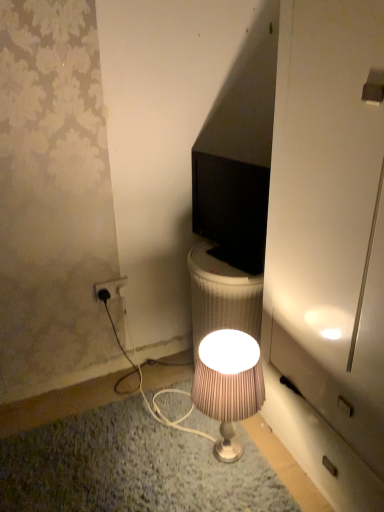
Where is `silky beige lampshade at center`? silky beige lampshade at center is located at coordinates (228, 384).

Find the location of a particular element. The image size is (384, 512). black glossy monitor at center is located at coordinates (231, 209).

Between point (230, 400) and point (119, 287), which one is positioned behind?

The point (119, 287) is farther from the camera.

Which is correct: silky beige lampshade at center is inside white plastic power outlet at lower left, or outside of it?

silky beige lampshade at center is not inside white plastic power outlet at lower left, it's outside.

Is silky beige lampshade at center at the left side of white plastic power outlet at lower left?

No.

Does point (228, 383) appear closer or farther from the camera than point (264, 180)?

Clearly, point (228, 383) is closer to the camera than point (264, 180).

Looking at their sizes, would you say silky beige lampshade at center is wider or thinner than black glossy monitor at center?

In the image, silky beige lampshade at center appears to be wider than black glossy monitor at center.

From the image's perspective, does silky beige lampshade at center appear higher than black glossy monitor at center?

Actually, silky beige lampshade at center appears below black glossy monitor at center in the image.

Can you confirm if silky beige lampshade at center is bigger than black glossy monitor at center?

Yes, silky beige lampshade at center is bigger than black glossy monitor at center.

Could you tell me if black glossy monitor at center is facing white plastic power outlet at lower left?

No, black glossy monitor at center does not turn towards white plastic power outlet at lower left.

Where is `power outlet on the left of black glossy monitor at center`? The image size is (384, 512). power outlet on the left of black glossy monitor at center is located at coordinates (110, 287).

Is black glossy monitor at center directly adjacent to white plastic power outlet at lower left?

No.

From a real-world perspective, is black glossy monitor at center positioned above or below white plastic power outlet at lower left?

black glossy monitor at center is above white plastic power outlet at lower left.

Is black glossy monitor at center not inside silky beige lampshade at center?

Yes.

Which object is positioned more to the left, black glossy monitor at center or silky beige lampshade at center?

Positioned to the left is silky beige lampshade at center.

Considering the sizes of objects black glossy monitor at center and silky beige lampshade at center in the image provided, who is taller, black glossy monitor at center or silky beige lampshade at center?

Standing taller between the two is silky beige lampshade at center.

Is point (253, 219) positioned before point (221, 367)?

No, (253, 219) is behind (221, 367).

From the image's perspective, which object appears higher, white plastic power outlet at lower left or black glossy monitor at center?

black glossy monitor at center appears higher in the image.

Is white plastic power outlet at lower left shorter than black glossy monitor at center?

Correct, white plastic power outlet at lower left is not as tall as black glossy monitor at center.

Between white plastic power outlet at lower left and black glossy monitor at center, which one has larger size?

With larger size is black glossy monitor at center.

Which object is wider, white plastic power outlet at lower left or black glossy monitor at center?

With larger width is black glossy monitor at center.

Is white plastic power outlet at lower left looking in the opposite direction of silky beige lampshade at center?

white plastic power outlet at lower left does not have its back to silky beige lampshade at center.

Is point (118, 288) positioned before point (226, 372)?

No, it is not.

Is white plastic power outlet at lower left not near silky beige lampshade at center?

white plastic power outlet at lower left is near silky beige lampshade at center, not far away.

In the image, there is a white plastic power outlet at lower left. Identify the location of lamp below it (from the image's perspective). The width and height of the screenshot is (384, 512). (228, 384).

This screenshot has height=512, width=384. Find the location of `computer monitor above the silky beige lampshade at center (from the image's perspective)`. computer monitor above the silky beige lampshade at center (from the image's perspective) is located at coordinates (231, 209).

Estimate the real-world distances between objects in this image. Which object is closer to silky beige lampshade at center, white plastic power outlet at lower left or black glossy monitor at center?

Based on the image, black glossy monitor at center appears to be nearer to silky beige lampshade at center.

From the image, which object appears to be farther from white plastic power outlet at lower left, silky beige lampshade at center or black glossy monitor at center?

silky beige lampshade at center is further to white plastic power outlet at lower left.

Based on the photo, considering their positions, is silky beige lampshade at center positioned closer to black glossy monitor at center than white plastic power outlet at lower left?

Among the two, silky beige lampshade at center is located nearer to black glossy monitor at center.

Which object lies nearer to the anchor point black glossy monitor at center, white plastic power outlet at lower left or silky beige lampshade at center?

The object closer to black glossy monitor at center is silky beige lampshade at center.

Estimate the real-world distances between objects in this image. Which object is closer to white plastic power outlet at lower left, black glossy monitor at center or silky beige lampshade at center?

Based on the image, black glossy monitor at center appears to be nearer to white plastic power outlet at lower left.

Looking at the image, which one is located further to silky beige lampshade at center, black glossy monitor at center or white plastic power outlet at lower left?

white plastic power outlet at lower left is positioned further to the anchor silky beige lampshade at center.

Locate an element on the screen. This screenshot has height=512, width=384. power outlet between black glossy monitor at center and silky beige lampshade at center in the vertical direction is located at coordinates (110, 287).